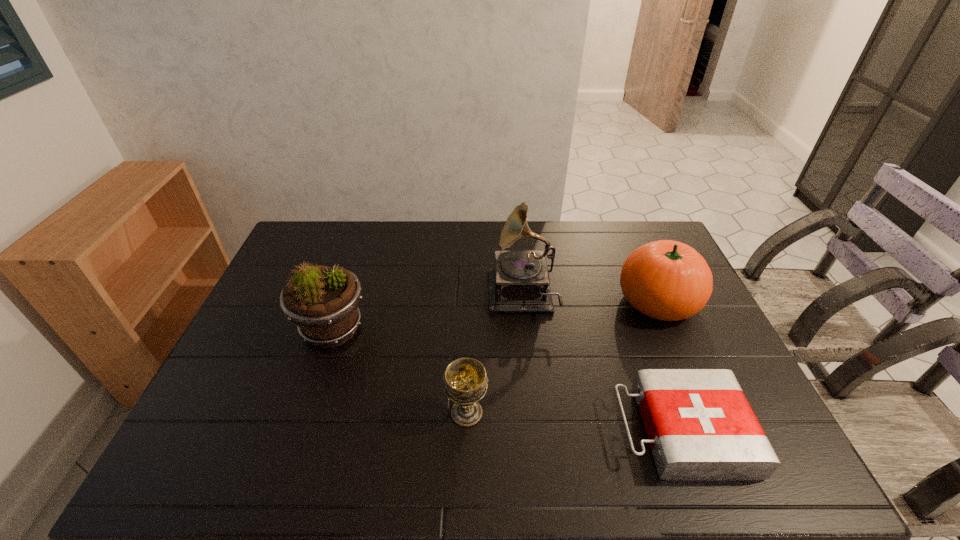
In the image, there is a desktop. Where is `vacant space at the far edge`? The image size is (960, 540). vacant space at the far edge is located at coordinates (371, 231).

Find the location of a particular element. This screenshot has height=540, width=960. free space at the near edge is located at coordinates (480, 463).

Identify the location of vacant space at the left edge. (287, 325).

The height and width of the screenshot is (540, 960). Identify the location of vacant space at the right edge of the desktop. (672, 327).

Where is `vacant area that lies between the second object from left to right and the shortest object`? vacant area that lies between the second object from left to right and the shortest object is located at coordinates (574, 422).

At what (x,y) coordinates should I click in order to perform the action: click on free space between the chalice and the third object from right to left. Please return your answer as a coordinate pair (x, y). This screenshot has width=960, height=540. Looking at the image, I should click on (494, 355).

Identify the location of free space that is in between the second object from left to right and the shortest object. (574, 422).

In order to click on free space between the record player and the third tallest object in this screenshot , I will do tap(589, 299).

Locate an element on the screen. free space between the flowerpot and the third object from left to right is located at coordinates (427, 313).

Find the location of a particular element. The width and height of the screenshot is (960, 540). empty space that is in between the pumpkin and the record player is located at coordinates (589, 299).